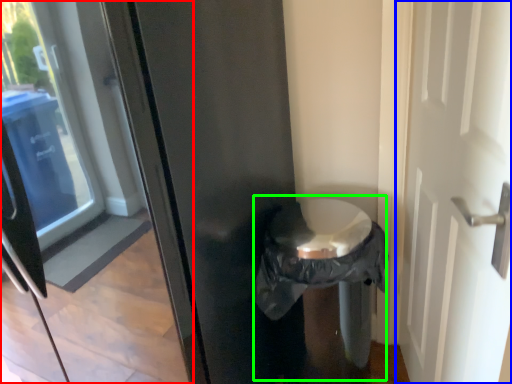
Question: Which is farther away from glass door (highlighted by a red box)? door (highlighted by a blue box) or garbage (highlighted by a green box)?

Choices:
 (A) door
 (B) garbage

Answer: (A)